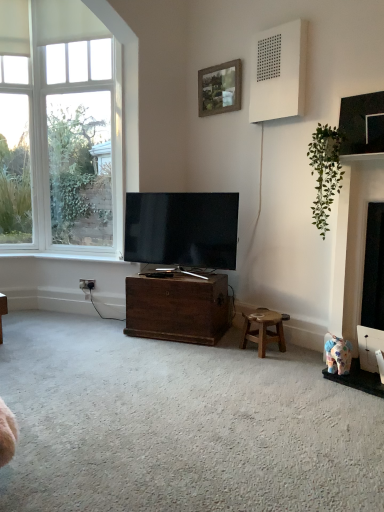
Question: Considering the relative positions of white matte speaker at upper right and wooden frame at upper center in the image provided, is white matte speaker at upper right in front of wooden frame at upper center?

Choices:
 (A) no
 (B) yes

Answer: (B)

Question: Could you tell me if white matte speaker at upper right is facing wooden frame at upper center?

Choices:
 (A) yes
 (B) no

Answer: (B)

Question: From a real-world perspective, is white matte speaker at upper right over wooden frame at upper center?

Choices:
 (A) yes
 (B) no

Answer: (A)

Question: Does white matte speaker at upper right have a smaller size compared to wooden frame at upper center?

Choices:
 (A) yes
 (B) no

Answer: (B)

Question: Does white matte speaker at upper right lie behind wooden frame at upper center?

Choices:
 (A) no
 (B) yes

Answer: (A)

Question: Is fluffy fabric elephant at lower right bigger or smaller than white painted wood at lower left?

Choices:
 (A) small
 (B) big

Answer: (A)

Question: Choose the correct answer: Is fluffy fabric elephant at lower right inside white painted wood at lower left or outside it?

Choices:
 (A) outside
 (B) inside

Answer: (A)

Question: Considering the positions of fluffy fabric elephant at lower right and white painted wood at lower left in the image, is fluffy fabric elephant at lower right taller or shorter than white painted wood at lower left?

Choices:
 (A) short
 (B) tall

Answer: (B)

Question: Considering the positions of point (342, 340) and point (87, 253), is point (342, 340) closer or farther from the camera than point (87, 253)?

Choices:
 (A) closer
 (B) farther

Answer: (A)

Question: In terms of size, does clear glass window at left appear bigger or smaller than wooden stool at lower right?

Choices:
 (A) small
 (B) big

Answer: (B)

Question: Visually, is clear glass window at left positioned to the left or to the right of wooden stool at lower right?

Choices:
 (A) left
 (B) right

Answer: (A)

Question: In terms of height, does clear glass window at left look taller or shorter compared to wooden stool at lower right?

Choices:
 (A) tall
 (B) short

Answer: (A)

Question: Is clear glass window at left in front of or behind wooden stool at lower right in the image?

Choices:
 (A) front
 (B) behind

Answer: (B)

Question: Is fluffy fabric elephant at lower right situated inside green leafy plant at upper right or outside?

Choices:
 (A) outside
 (B) inside

Answer: (A)

Question: Is fluffy fabric elephant at lower right in front of or behind green leafy plant at upper right in the image?

Choices:
 (A) front
 (B) behind

Answer: (A)